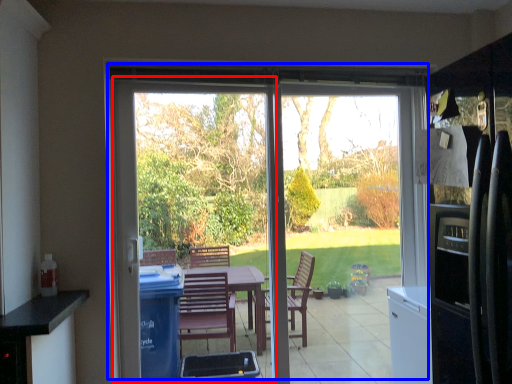
Question: Among these objects, which one is farthest to the camera, screen door (highlighted by a red box) or door (highlighted by a blue box)?

Choices:
 (A) screen door
 (B) door

Answer: (B)